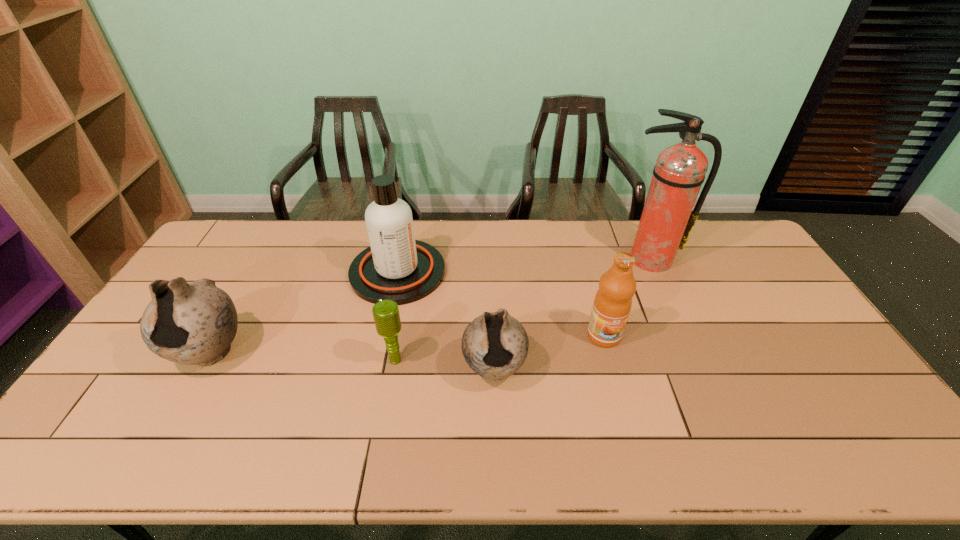
This screenshot has width=960, height=540. I want to click on vacant space that is in between the fire extinguisher and the fifth shortest object, so click(x=523, y=266).

Locate an element on the screen. free point between the fire extinguisher and the shorter pottery is located at coordinates (571, 314).

Where is `object that is the third closest one to the rightmost object`? The height and width of the screenshot is (540, 960). object that is the third closest one to the rightmost object is located at coordinates (397, 267).

Select which object is the third closest to the right pottery. Please provide its 2D coordinates. Your answer should be formatted as a tuple, i.e. [(x, y)], where the tuple contains the x and y coordinates of a point satisfying the conditions above.

[(612, 303)]

I want to click on free point that satisfies the following two spatial constraints: 1. on the front side of the microphone; 2. on the left side of the fifth shortest object, so click(x=379, y=360).

Locate an element on the screen. vacant area that satisfies the following two spatial constraints: 1. from the spout of the microphone; 2. on the left side of the left pottery is located at coordinates (206, 360).